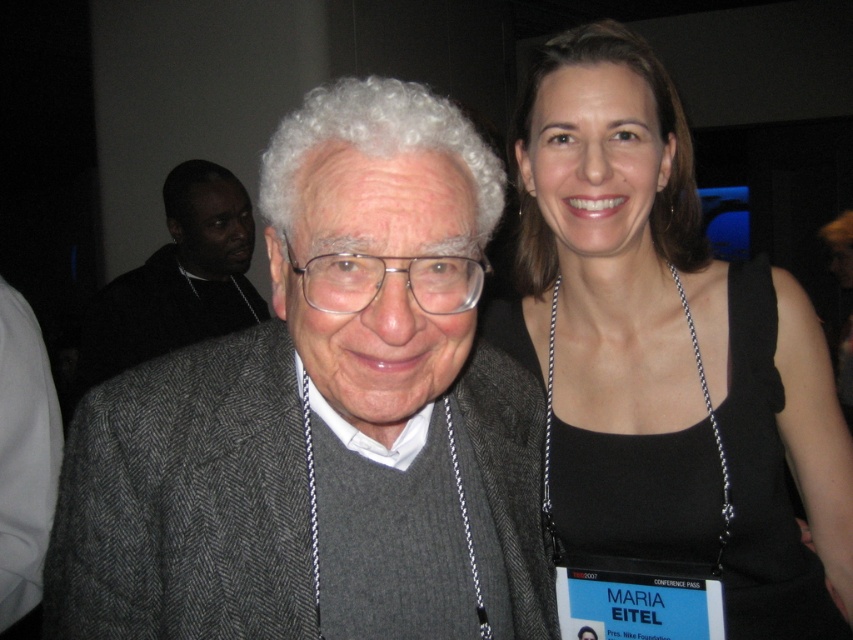
You are a photographer at a conference who needs to adjust lighting to highlight both the black fabric tank top at upper right and the silver chain necklace at upper right. Since the tank top is taller than the necklace, which object should you focus on first to ensure proper exposure?

The black fabric tank top at upper right is taller than the silver chain necklace at upper right, so you should focus on the black fabric tank top at upper right first to ensure proper exposure.

You are at a conference and need to locate the gray herringbone blazer at center. You see the point marked at coordinates (320, 413). Is the gray herringbone blazer at center located at that point?

Yes, the gray herringbone blazer at center is represented by the point at coordinates (320, 413).

You are at a conference and need to identify the clothing items based on their positions. Which clothing item is positioned lower between the black fabric tank top at upper right and the dark gray sweater at center?

The black fabric tank top at upper right is located below the dark gray sweater at center, so the black fabric tank top at upper right is positioned lower.